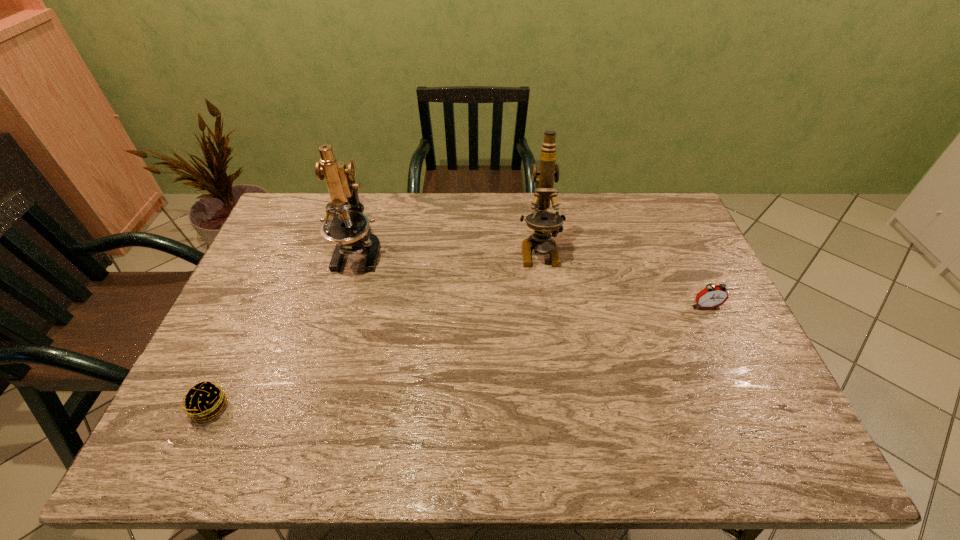
The image size is (960, 540). Find the location of `the closest object to the right microscope`. the closest object to the right microscope is located at coordinates (712, 296).

The width and height of the screenshot is (960, 540). In order to click on vacant space that satisfies the following two spatial constraints: 1. on the back side of the right microscope; 2. on the left side of the patty in this screenshot , I will do `click(282, 249)`.